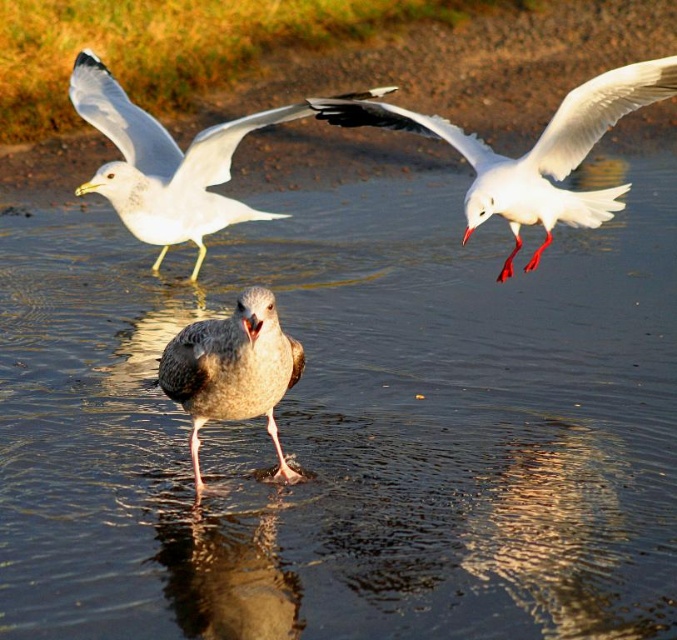
You are a photographer standing at the edge of the water, aiming to capture a clear photo of the white glossy seagull at upper right. The camera you have can focus on subjects within 3 meters. Will the seagull be in focus?

The white glossy seagull at upper right is 3.72 meters from camera, which is beyond the camera focus range of 3 meters. Therefore, the seagull will not be in focus.

You are a birdwatcher observing the scene. You notice the white matte seagull at upper left and the gray feathered bird at center. Which of these two birds has a larger wingspan based on their current positions?

The white matte seagull at upper left might be wider than gray feathered bird at center, suggesting it could have a larger wingspan.

You are a birdwatcher observing the scene. You see the white matte seagull at upper left and the gray feathered bird at center. Which one appears larger in size?

The white matte seagull at upper left is bigger than the gray feathered bird at center.